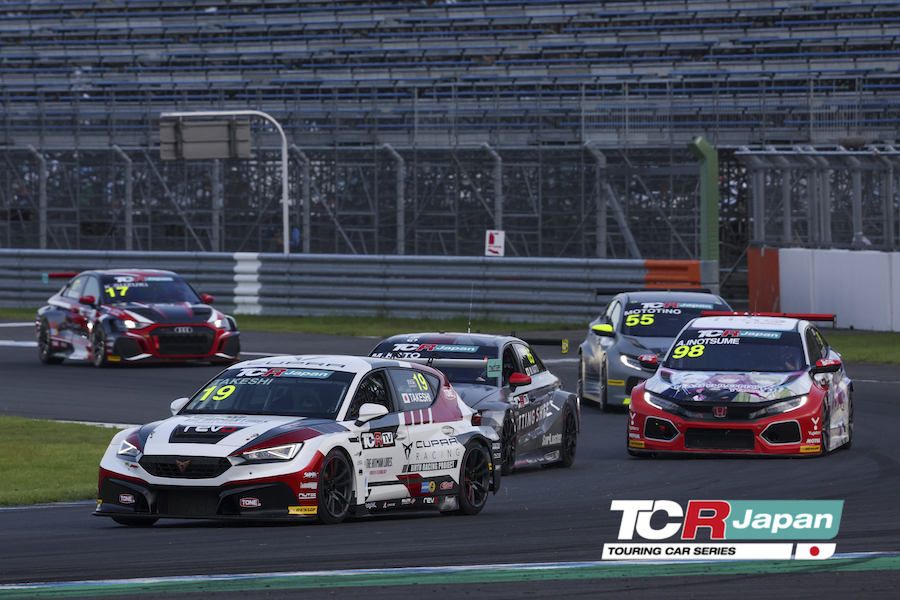
The width and height of the screenshot is (900, 600). In order to click on side windows in this screenshot , I will do `click(94, 289)`, `click(68, 288)`, `click(415, 378)`, `click(531, 358)`, `click(608, 304)`, `click(616, 316)`, `click(819, 336)`, `click(807, 345)`.